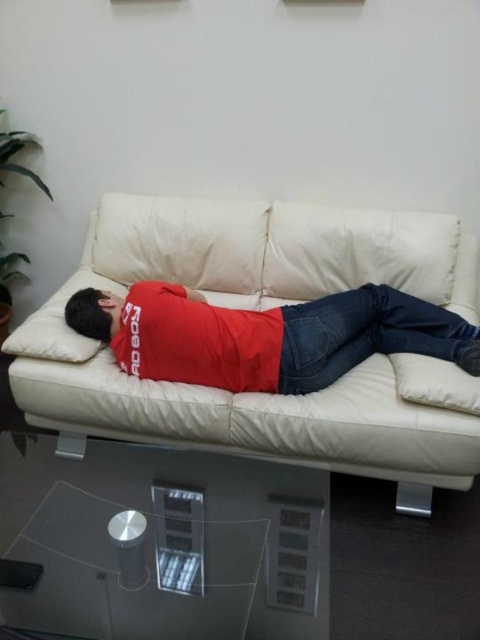
How much distance is there between white leather couch at center and transparent glass table at lower center?

The distance of white leather couch at center from transparent glass table at lower center is 19.52 inches.

Who is higher up, white leather couch at center or transparent glass table at lower center?

white leather couch at center

Is point (288, 300) positioned in front of point (40, 628)?

No, (288, 300) is further to viewer.

The width and height of the screenshot is (480, 640). What are the coordinates of `white leather couch at center` in the screenshot? It's located at (262, 308).

Is transparent glass table at lower center above matte red shirt at center?

No.

Which is more to the left, transparent glass table at lower center or matte red shirt at center?

Positioned to the left is transparent glass table at lower center.

You are a GUI agent. You are given a task and a screenshot of the screen. Output one action in this format:
    pyautogui.click(x=<x>, y=<y>)
    Task: Click on the transparent glass table at lower center
    
    Given the screenshot: What is the action you would take?
    pyautogui.click(x=164, y=544)

Between white leather couch at center and matte red shirt at center, which one appears on the left side from the viewer's perspective?

From the viewer's perspective, white leather couch at center appears more on the left side.

Between white leather couch at center and matte red shirt at center, which one has less height?

Standing shorter between the two is matte red shirt at center.

Locate an element on the screen. The width and height of the screenshot is (480, 640). white leather couch at center is located at coordinates (262, 308).